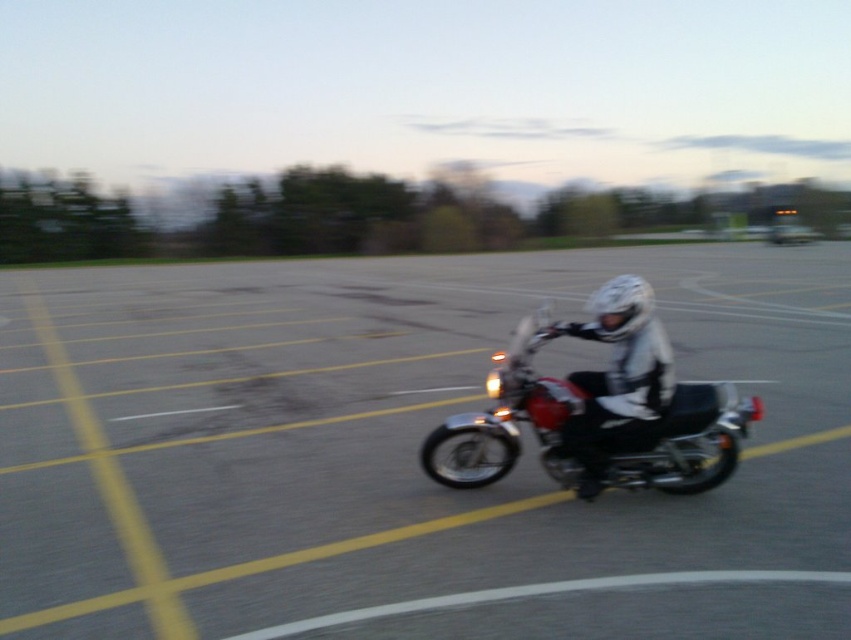
Between gray asphalt parking lot at center and white matte helmet at center, which one is positioned lower?

Positioned lower is gray asphalt parking lot at center.

Is gray asphalt parking lot at center to the right of white matte helmet at center from the viewer's perspective?

In fact, gray asphalt parking lot at center is to the left of white matte helmet at center.

The width and height of the screenshot is (851, 640). What do you see at coordinates (374, 435) in the screenshot?
I see `gray asphalt parking lot at center` at bounding box center [374, 435].

In order to click on gray asphalt parking lot at center in this screenshot , I will do `click(374, 435)`.

Who is lower down, shiny chrome motorcycle at center or white matte helmet at upper center?

Positioned lower is shiny chrome motorcycle at center.

Does shiny chrome motorcycle at center have a greater width compared to white matte helmet at upper center?

No.

Identify the location of shiny chrome motorcycle at center. This screenshot has height=640, width=851. (513, 416).

Can you confirm if gray asphalt parking lot at center is positioned above shiny chrome motorcycle at center?

Indeed, gray asphalt parking lot at center is positioned over shiny chrome motorcycle at center.

Is gray asphalt parking lot at center thinner than shiny chrome motorcycle at center?

No.

What are the coordinates of `gray asphalt parking lot at center` in the screenshot? It's located at (374, 435).

I want to click on gray asphalt parking lot at center, so click(374, 435).